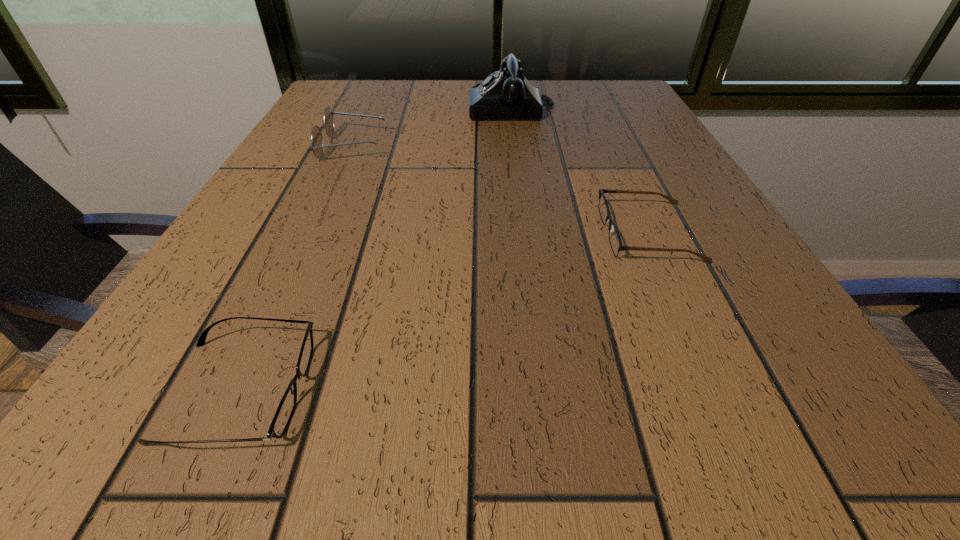
Where is `free space between the rightmost spectacles and the nearest object`? The width and height of the screenshot is (960, 540). free space between the rightmost spectacles and the nearest object is located at coordinates (444, 312).

I want to click on free area in between the tallest spectacles and the second nearest spectacles, so click(x=500, y=190).

At what (x,y) coordinates should I click in order to perform the action: click on free space between the nearest spectacles and the telephone. Please return your answer as a coordinate pair (x, y). Image resolution: width=960 pixels, height=540 pixels. Looking at the image, I should click on (375, 249).

Where is `free space between the nearest spectacles and the rightmost object`? The image size is (960, 540). free space between the nearest spectacles and the rightmost object is located at coordinates (444, 312).

At what (x,y) coordinates should I click in order to perform the action: click on free spot between the telephone and the nearest object. Please return your answer as a coordinate pair (x, y). The height and width of the screenshot is (540, 960). Looking at the image, I should click on (375, 249).

You are a GUI agent. You are given a task and a screenshot of the screen. Output one action in this format:
    pyautogui.click(x=<x>, y=<y>)
    Task: Click on the object that stands as the third closest to the farthest spectacles
    
    Given the screenshot: What is the action you would take?
    pyautogui.click(x=615, y=241)

Where is `object that is the third closest to the nearest spectacles`? object that is the third closest to the nearest spectacles is located at coordinates (507, 94).

The image size is (960, 540). In order to click on spectacles that is the second closest to the second tallest object in this screenshot , I will do `click(615, 241)`.

Identify which spectacles is the nearest to the rightmost object. Please provide its 2D coordinates. Your answer should be formatted as a tuple, i.e. [(x, y)], where the tuple contains the x and y coordinates of a point satisfying the conditions above.

[(281, 420)]